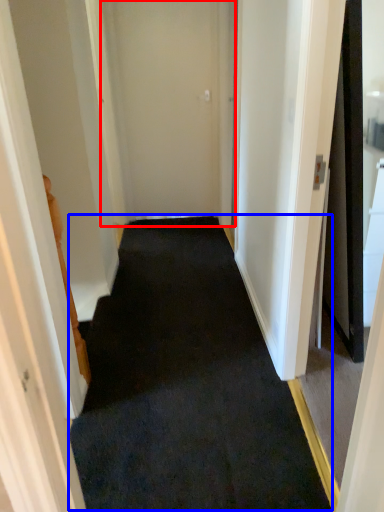
Question: Which object appears farthest to the camera in this image, door (highlighted by a red box) or doormat (highlighted by a blue box)?

Choices:
 (A) door
 (B) doormat

Answer: (A)